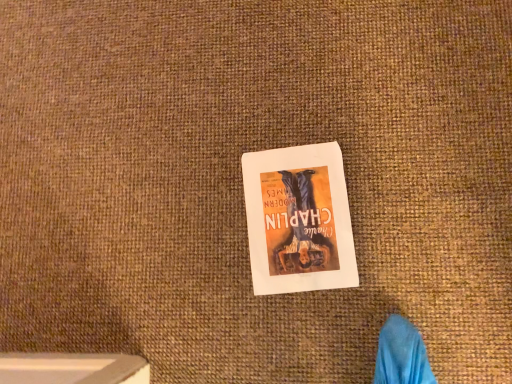
Where is `free location above white paper at center (from a real-world perspective)`? The width and height of the screenshot is (512, 384). free location above white paper at center (from a real-world perspective) is located at coordinates (298, 217).